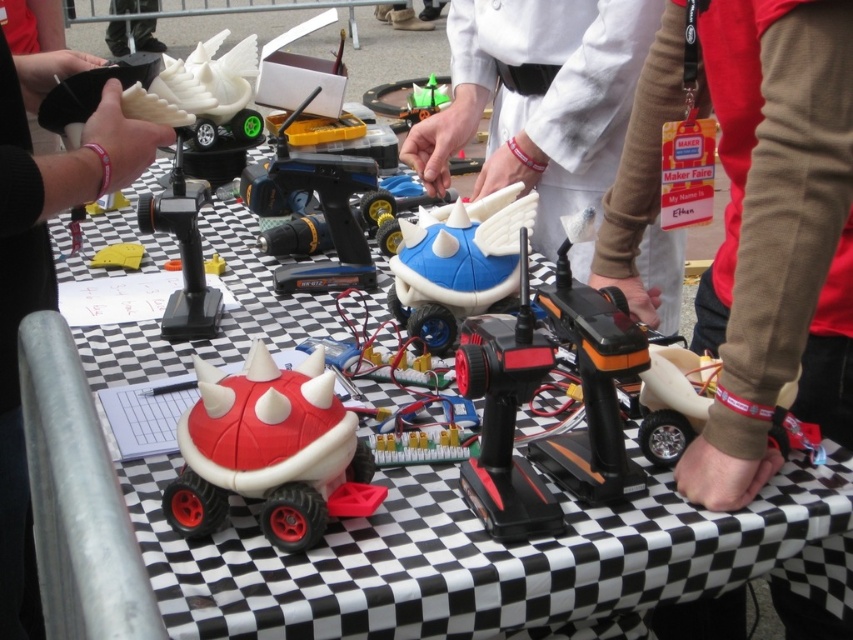
Can you confirm if white matte toy at center is taller than matte black glove at upper left?

In fact, white matte toy at center may be shorter than matte black glove at upper left.

Does point (502, 92) come in front of point (10, 566)?

No, it is behind (10, 566).

Who is more forward, (672, 285) or (125, 168)?

Positioned in front is point (125, 168).

Find the location of `white matte toy at center`. white matte toy at center is located at coordinates (538, 99).

Can you confirm if matte black glove at upper left is positioned to the right of green matte toy at center?

Incorrect, matte black glove at upper left is not on the right side of green matte toy at center.

Where is `matte black glove at upper left`? matte black glove at upper left is located at coordinates (42, 272).

Does brown leather jacket at upper center appear under white matte toy at center?

Yes.

Who is more distant from viewer, (x=830, y=624) or (x=519, y=38)?

The point (x=519, y=38) is more distant.

Find the location of a particular element. The width and height of the screenshot is (853, 640). brown leather jacket at upper center is located at coordinates (775, 234).